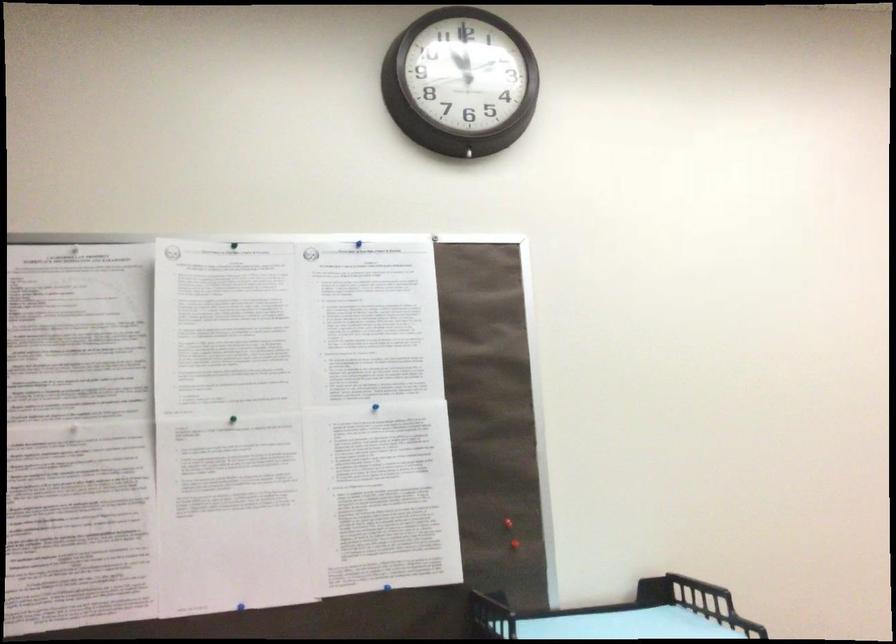
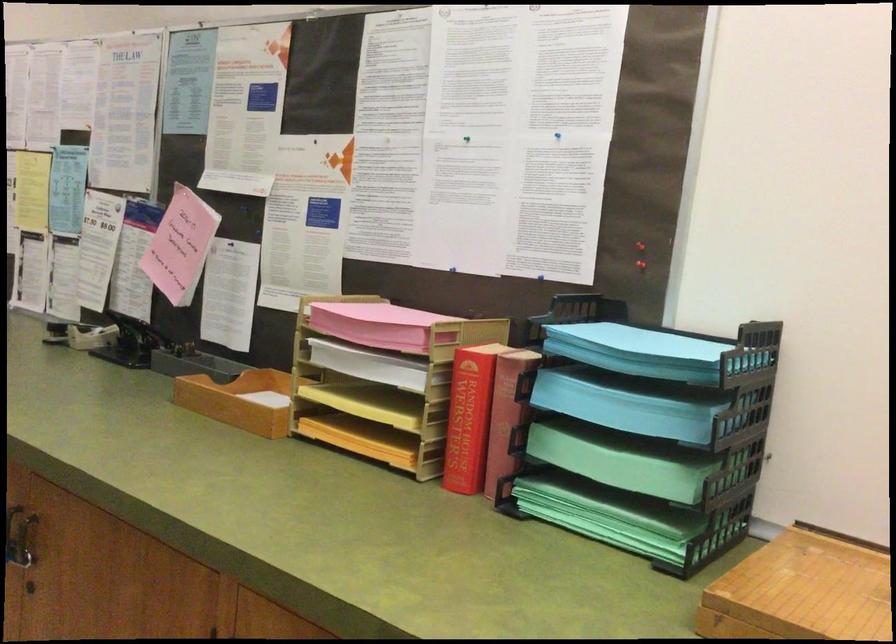
Locate, in the second image, the point that corresponds to (x=227, y=422) in the first image.

(467, 138)